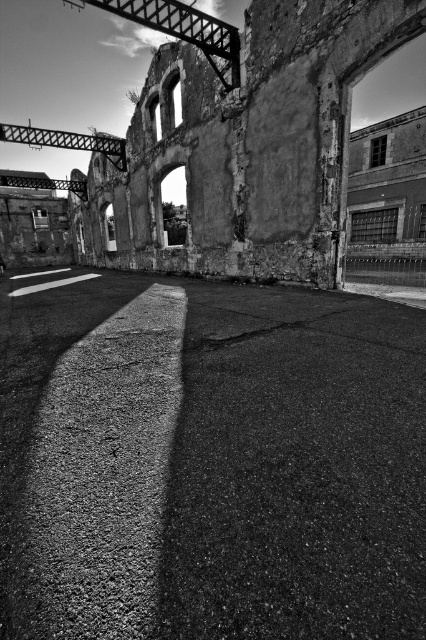
Does asphalt at center appear under rough concrete ruins at center?

Yes.

Is the position of asphalt at center less distant than that of rough concrete ruins at center?

Yes, asphalt at center is closer to the viewer.

Describe the element at coordinates (210, 464) in the screenshot. The image size is (426, 640). I see `asphalt at center` at that location.

Identify the location of asphalt at center. click(x=210, y=464).